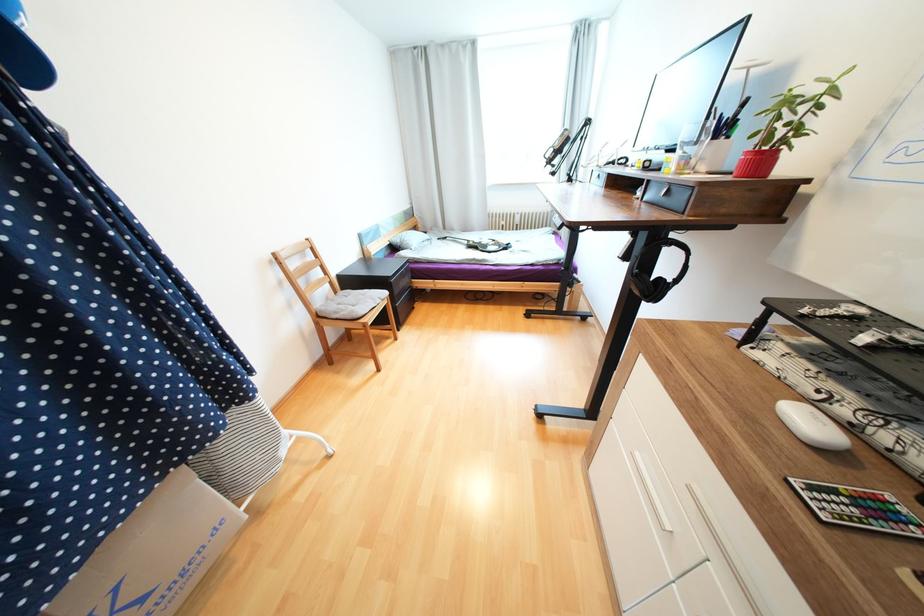
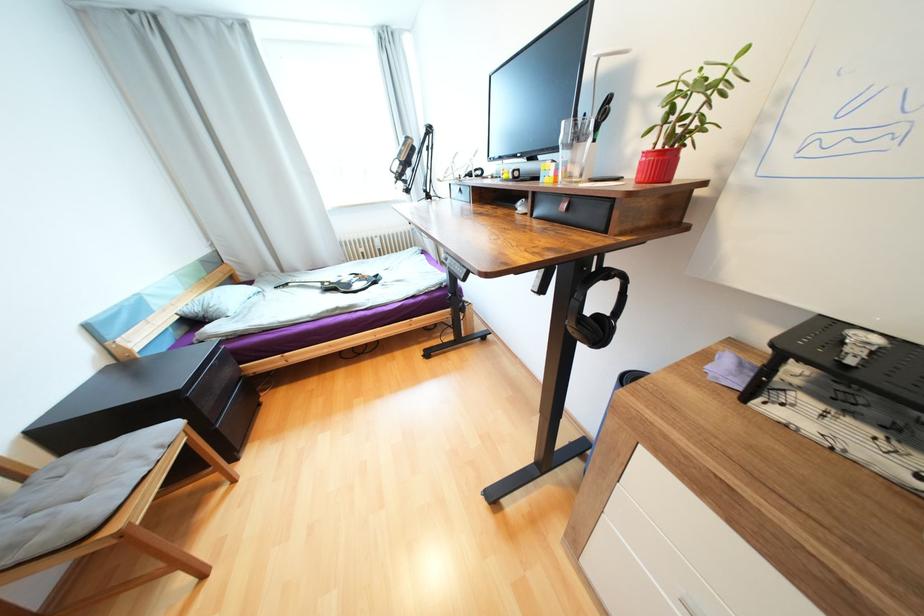
Question: The images are taken continuously from a first-person perspective. In which direction is your viewpoint rotating?

Choices:
 (A) Left
 (B) Right
 (C) Up
 (D) Down

Answer: (B)